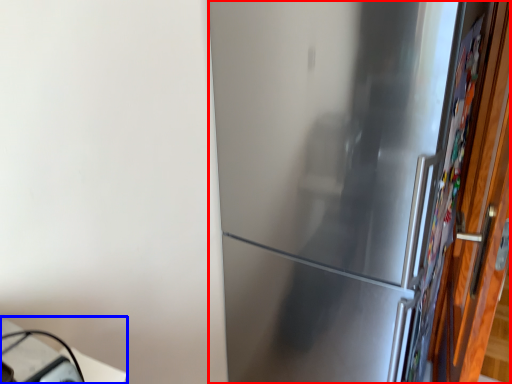
Question: Which object is closer to the camera taking this photo, refrigerator (highlighted by a red box) or table (highlighted by a blue box)?

Choices:
 (A) refrigerator
 (B) table

Answer: (B)